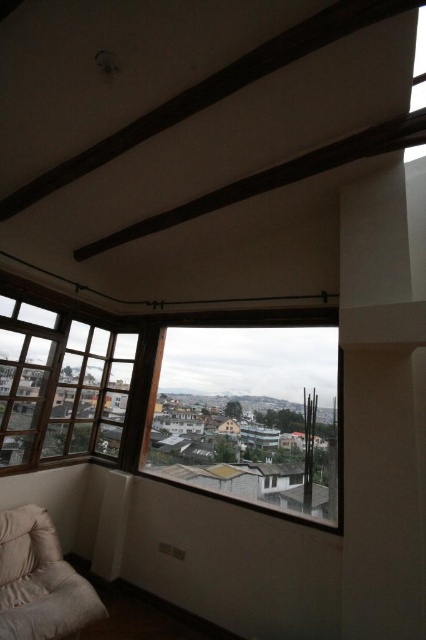
Question: Which point is closer to the camera?

Choices:
 (A) transparent glass window at center
 (B) white soft pillow at lower left
 (C) clear glass window at left

Answer: (B)

Question: Is clear glass window at left to the left of beige fabric couch at lower left from the viewer's perspective?

Choices:
 (A) no
 (B) yes

Answer: (B)

Question: Considering the real-world distances, which object is closest to the white soft pillow at lower left?

Choices:
 (A) dark wood beam at upper center
 (B) beige fabric couch at lower left
 (C) clear glass window at left
 (D) transparent glass window at center

Answer: (B)

Question: Can you confirm if transparent glass window at center is positioned to the right of clear glass window at left?

Choices:
 (A) yes
 (B) no

Answer: (A)

Question: Which point is closer to the camera?

Choices:
 (A) clear glass window at left
 (B) beige fabric couch at lower left
 (C) transparent glass window at center

Answer: (B)

Question: Observing the image, what is the correct spatial positioning of dark wood beam at upper center in reference to beige fabric couch at lower left?

Choices:
 (A) left
 (B) right

Answer: (B)